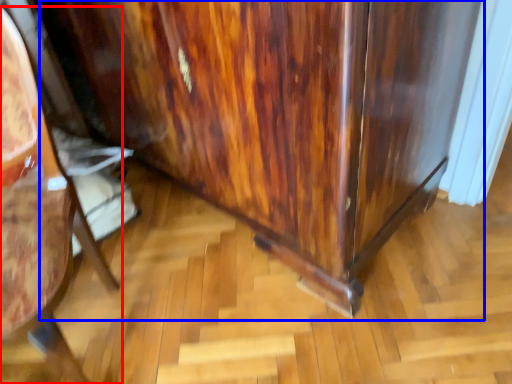
Question: Which object appears farthest to the camera in this image, furniture (highlighted by a red box) or dresser (highlighted by a blue box)?

Choices:
 (A) furniture
 (B) dresser

Answer: (B)